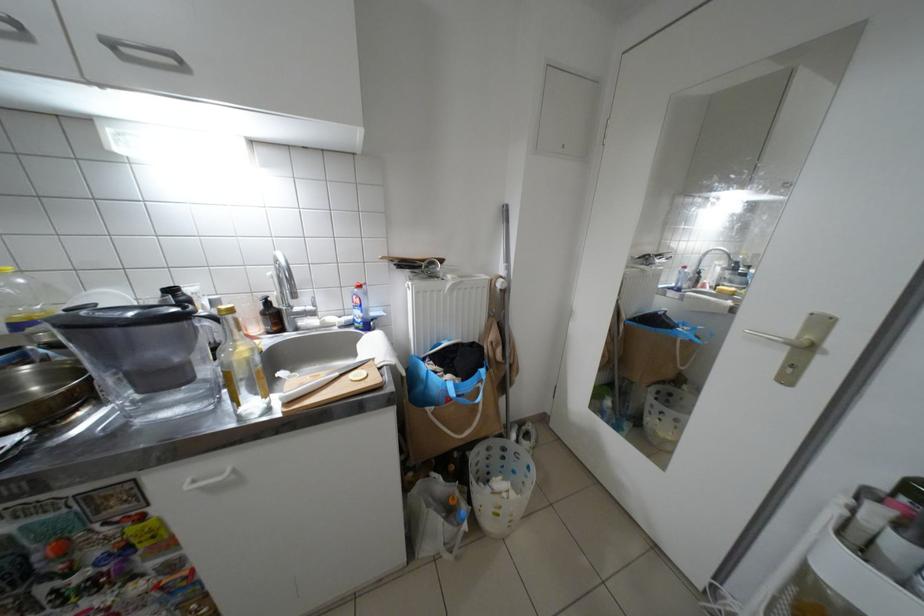
I want to click on glass bottle, so click(241, 368).